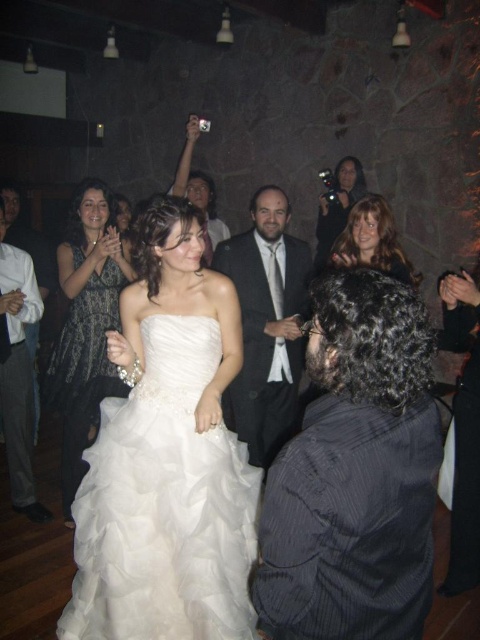
Can you confirm if dark gray textured dress at upper left is bigger than blonde hair at upper center?

Yes, dark gray textured dress at upper left is bigger than blonde hair at upper center.

Is dark gray textured dress at upper left positioned at the back of blonde hair at upper center?

Yes, it is behind blonde hair at upper center.

Is point (91, 340) positioned after point (375, 221)?

Yes, point (91, 340) is behind point (375, 221).

This screenshot has width=480, height=640. Identify the location of dark gray textured dress at upper left. (86, 346).

Is dark gray suit at center shorter than matte black dress at left?

Correct, dark gray suit at center is not as tall as matte black dress at left.

This screenshot has height=640, width=480. I want to click on dark gray suit at center, so click(265, 324).

Between point (252, 221) and point (124, 272), which one is positioned in front?

Point (124, 272) is in front.

Locate an element on the screen. The image size is (480, 640). dark gray suit at center is located at coordinates (265, 324).

Between dark gray suit at center and dark gray textured dress at upper left, which one is positioned higher?

dark gray suit at center

Is dark gray suit at center wider than dark gray textured dress at upper left?

Yes.

This screenshot has width=480, height=640. Find the location of `dark gray suit at center`. dark gray suit at center is located at coordinates (265, 324).